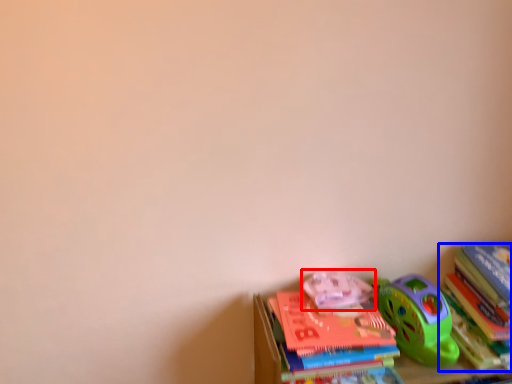
Question: Which object is closer to the camera taking this photo, toy (highlighted by a red box) or book (highlighted by a blue box)?

Choices:
 (A) toy
 (B) book

Answer: (B)